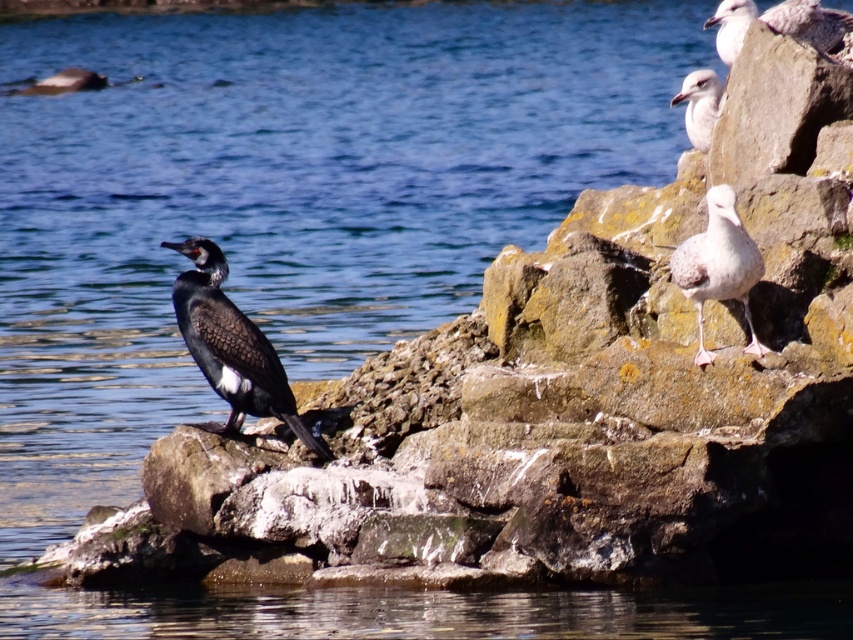
Locate an element on the screen. shiny black bird at center is located at coordinates (231, 346).

Can you confirm if shiny black bird at center is positioned above white matte seagull at upper right?

Incorrect, shiny black bird at center is not positioned above white matte seagull at upper right.

In order to click on shiny black bird at center in this screenshot , I will do `click(231, 346)`.

Who is more forward, (200,285) or (740,0)?

Point (200,285) is in front.

Based on the photo, which is above, shiny black bird at center or white glossy seagull at upper right?

white glossy seagull at upper right is higher up.

Between point (242, 396) and point (738, 13), which one is positioned behind?

Positioned behind is point (738, 13).

The width and height of the screenshot is (853, 640). Identify the location of shiny black bird at center. pyautogui.click(x=231, y=346).

Who is positioned more to the right, white feathered bird at upper right or white matte seagull at upper right?

white matte seagull at upper right is more to the right.

The width and height of the screenshot is (853, 640). Describe the element at coordinates (718, 266) in the screenshot. I see `white feathered bird at upper right` at that location.

Find the location of a particular element. The image size is (853, 640). white feathered bird at upper right is located at coordinates (718, 266).

You are a GUI agent. You are given a task and a screenshot of the screen. Output one action in this format:
    pyautogui.click(x=<x>, y=<y>)
    Task: Click on the white feathered bird at upper right
    This screenshot has width=853, height=640.
    Given the screenshot: What is the action you would take?
    pyautogui.click(x=718, y=266)